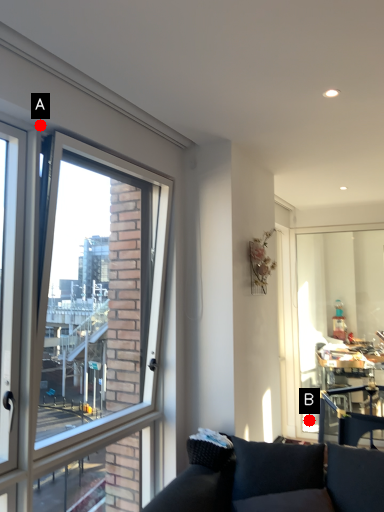
Question: Two points are circled on the image, labeled by A and B beside each circle. Which of the following is the closest to the observer?

Choices:
 (A) A is closer
 (B) B is closer

Answer: (A)